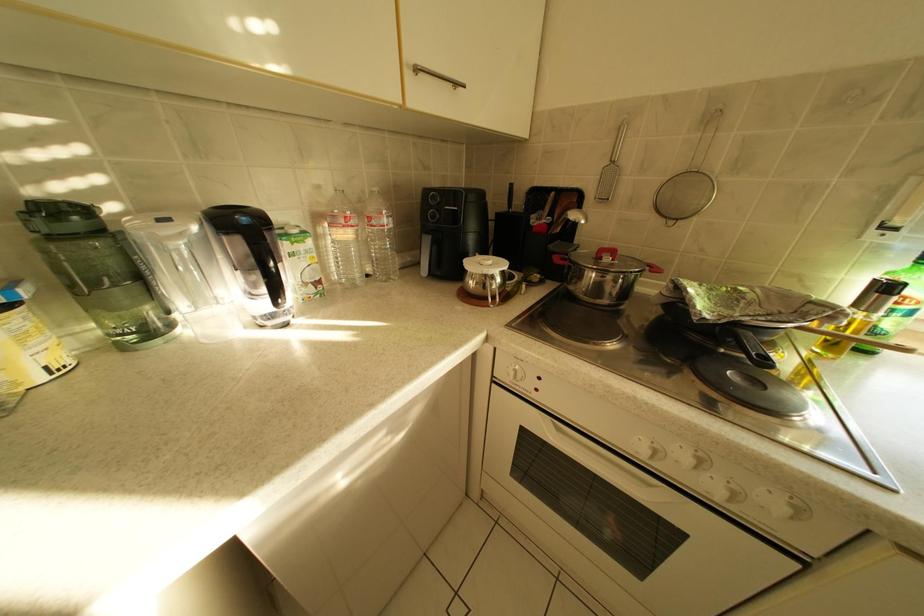
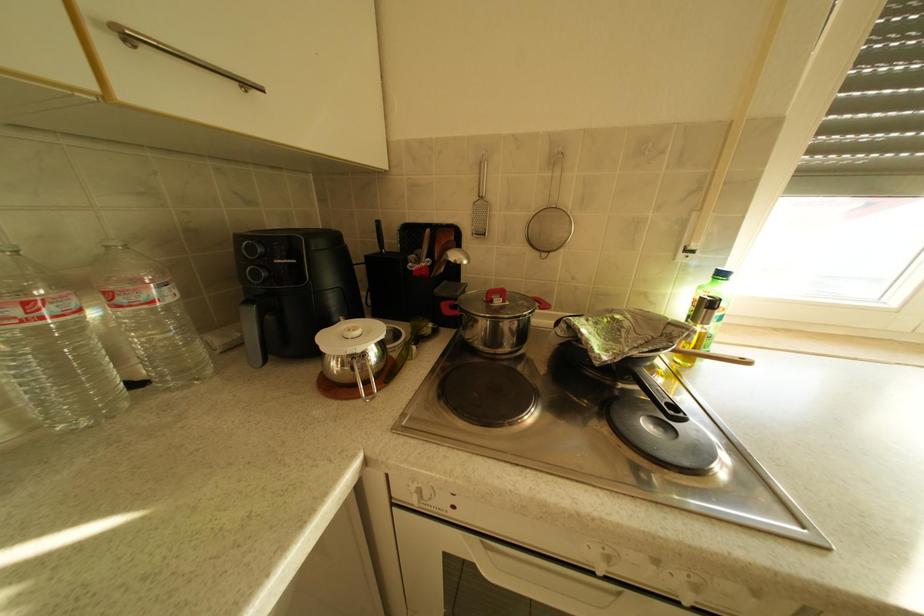
Question: The camera is either moving clockwise (left) or counter-clockwise (right) around the object. The first image is from the beginning of the video and the second image is from the end. Is the camera moving left or right when shooting the video?

Choices:
 (A) Left
 (B) Right

Answer: (A)